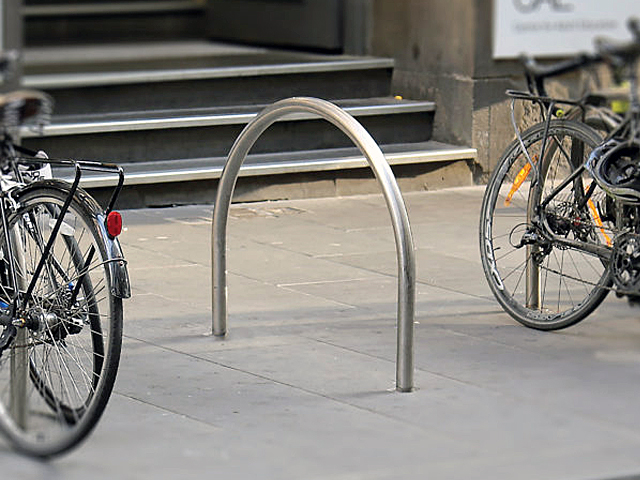
This screenshot has height=480, width=640. I want to click on stairs, so click(175, 182), click(169, 134), click(139, 83), click(130, 11).